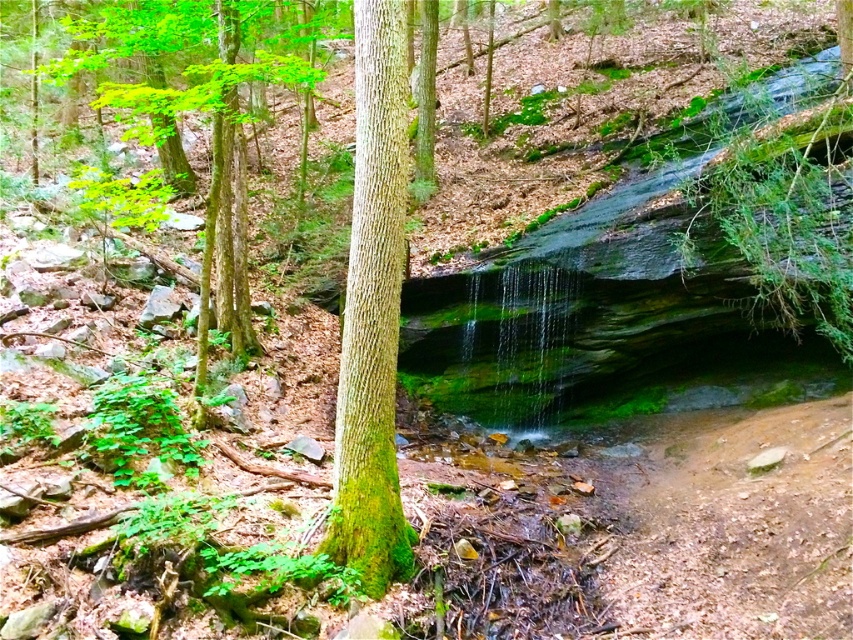
You are standing in the forest looking at the waterfall. There are two points marked in the scene. The first point is at coordinates point (x=374, y=150) and the second is at point (x=167, y=12). Which point is closer to you?

Point (x=374, y=150) is closer to the viewer than point (x=167, y=12).

You are standing in the forest and want to find the green mossy bark tree at center. According to the image coordinates, where should you look?

The green mossy bark tree at center is located at coordinates point (372, 312).